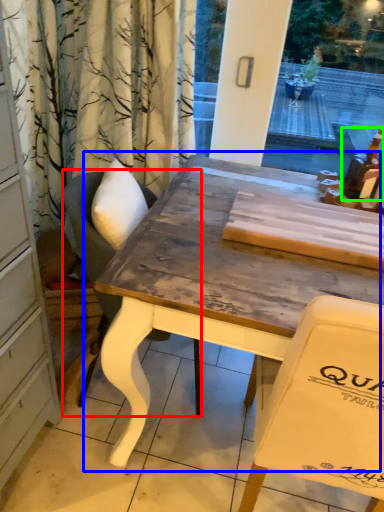
Question: Based on their relative distances, which object is nearer to chair (highlighted by a red box)? Choose from table (highlighted by a blue box) and alcohol (highlighted by a green box).

Choices:
 (A) table
 (B) alcohol

Answer: (A)